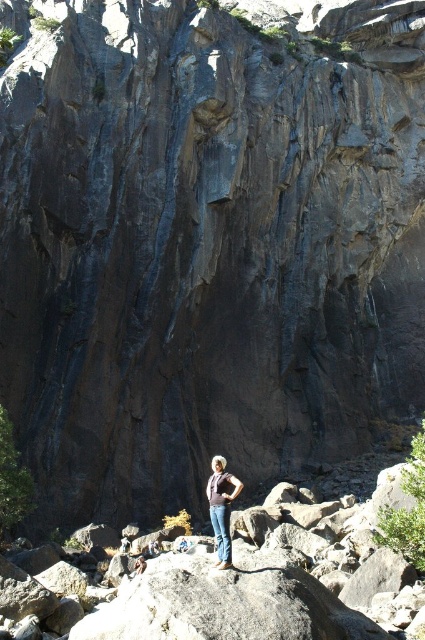
Question: Does denim pants at center have a lesser width compared to denim jeans at center?

Choices:
 (A) no
 (B) yes

Answer: (A)

Question: Is denim pants at center wider than denim jeans at center?

Choices:
 (A) yes
 (B) no

Answer: (A)

Question: Does denim pants at center lie in front of denim jeans at center?

Choices:
 (A) no
 (B) yes

Answer: (B)